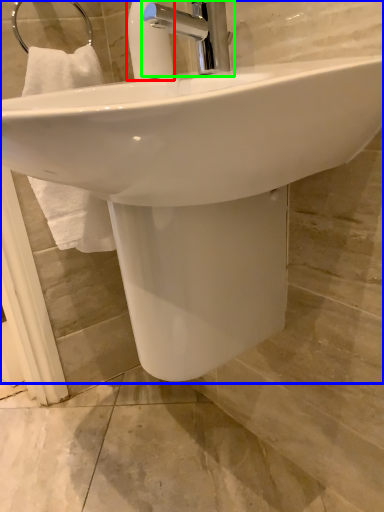
Question: Based on their relative distances, which object is farther from soap dispenser (highlighted by a red box)? Choose from sink (highlighted by a blue box) and tap (highlighted by a green box).

Choices:
 (A) sink
 (B) tap

Answer: (A)